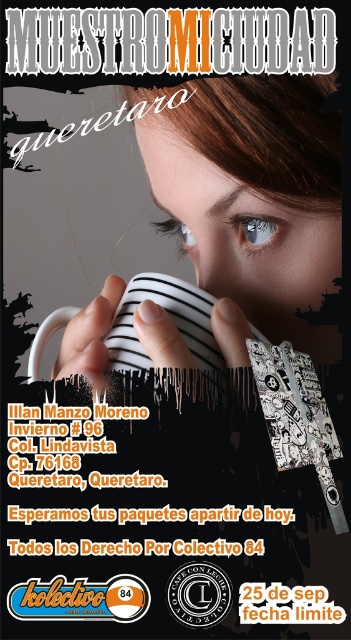
You are designing a promotional poster and need to ensure that the white striped mug at center and the blue glass eye at center fit within a 10 cm wide section. Based on their sizes, will both items fit side by side without overlapping?

The white striped mug at center might be wider than blue glass eye at center, so there is a possibility that together they exceed the 10 cm width limit. To ensure they fit, you should check their exact dimensions or adjust their positions.

You are an artist analyzing the composition of this promotional poster. You notice the white striped mug at center and the blue glass eye at center. Based on their positions, which object is closer to the bottom edge of the poster?

The white striped mug at center is closer to the bottom edge of the poster because it is positioned below the blue glass eye at center.